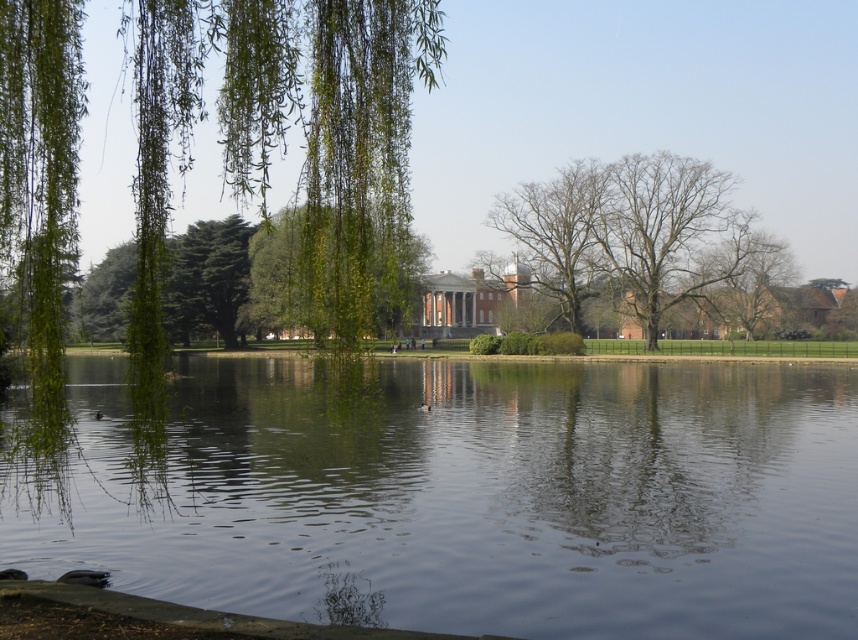
You are a park visitor wanting to take a photo of the bare wood tree at center without any branches blocking it. Can you do so by standing behind the green leafy willow at left?

The green leafy willow at left is positioned over the bare wood tree at center, so standing behind the green leafy willow at left would place you between the willow and the tree, meaning the willow branches might still block the view of the bare wood tree at center.

You are standing in the park and want to take a photo of the transparent water at center and the green leafy willow at left. Which object will appear closer to the camera in the photo?

The transparent water at center appears closer to the camera in the photo because it is in front of the green leafy willow at left.